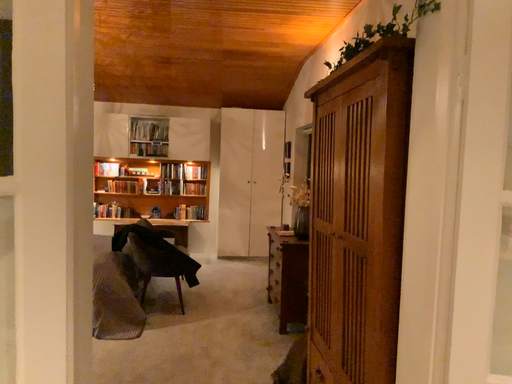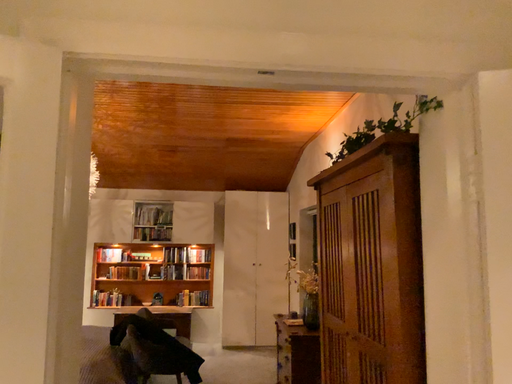
Question: Which way did the camera rotate in the video?

Choices:
 (A) rotated upward
 (B) rotated downward

Answer: (A)